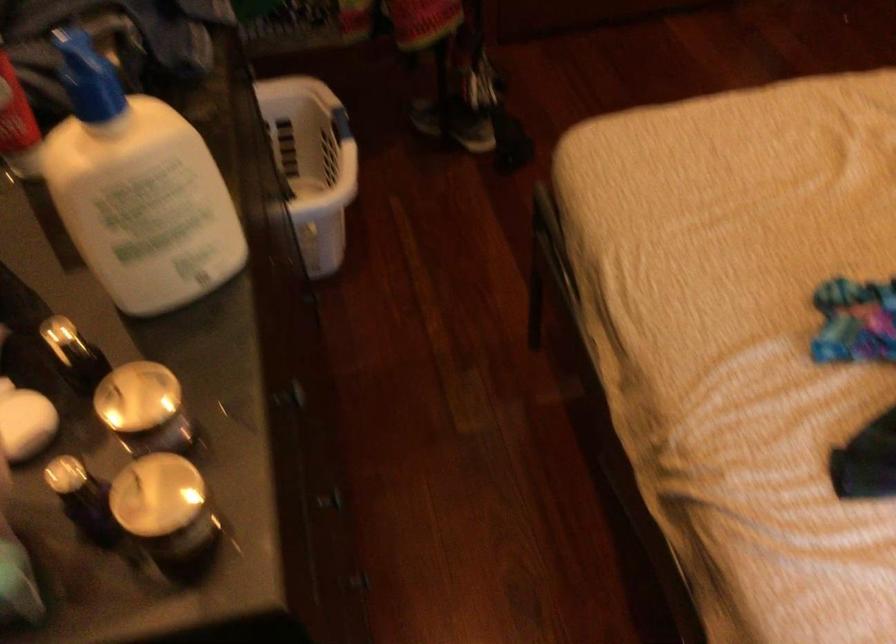
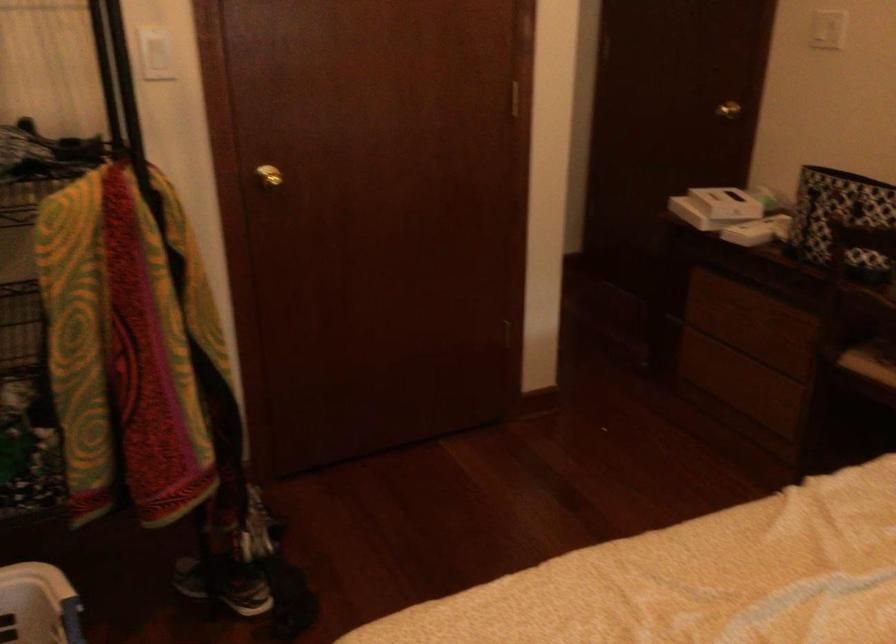
Locate, in the second image, the point that corresponds to point 332,118 in the first image.

(63, 616)